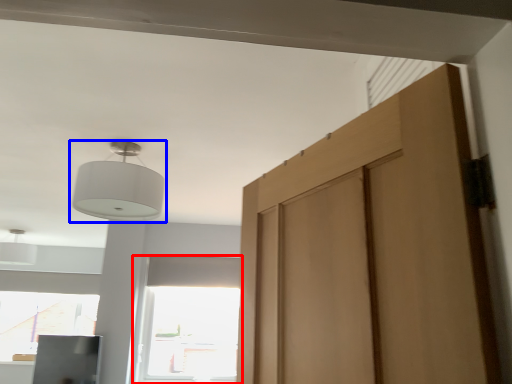
Question: Which object is further to the camera taking this photo, window (highlighted by a red box) or lamp (highlighted by a blue box)?

Choices:
 (A) window
 (B) lamp

Answer: (A)